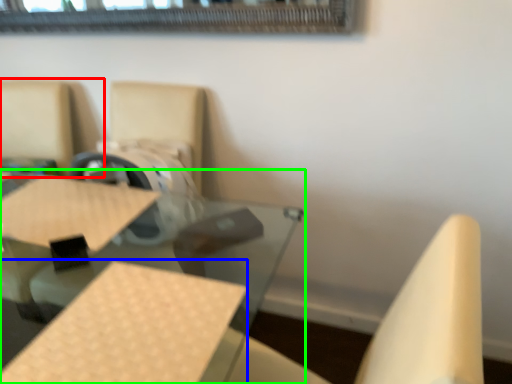
Question: Estimate the real-world distances between objects in this image. Which object is closer to chair (highlighted by a red box), plywood (highlighted by a blue box) or table (highlighted by a green box)?

Choices:
 (A) plywood
 (B) table

Answer: (B)